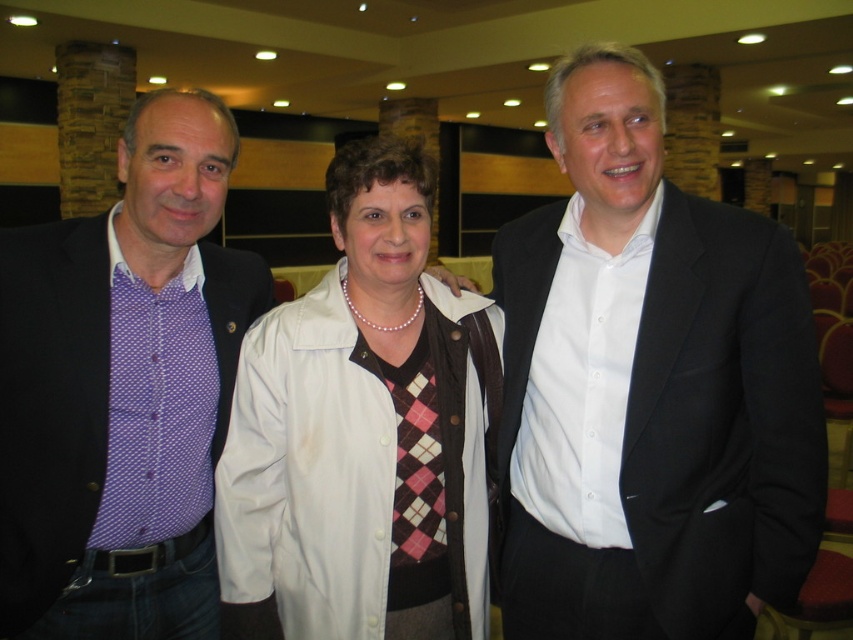
You are planning to take a photo of the three individuals in the scene. To ensure the black matte suit at center is in the center of the photo, where should you position the camera relative to the other two people?

The black matte suit at center is already positioned at the center of the image at coordinates point (x=648, y=387). Therefore, the camera should be aligned to keep it centered while positioning the other two individuals symmetrically on either side to maintain balance.

You are a photographer at the event and need to arrange the three people in a line for a group photo. The client wants the tallest person in the center. Given the purple dotted shirt at left and the white leather jacket at center, which one should you move to the center position?

The purple dotted shirt at left is taller than the white leather jacket at center, so you should move the purple dotted shirt at left to the center position.

You are at a networking event and want to approach the black matte suit at center and the purple dotted shirt at left. Which one should you approach first if you want to greet the person nearest to you?

You should approach the black matte suit at center first because it is closer to the viewer than the purple dotted shirt at left.